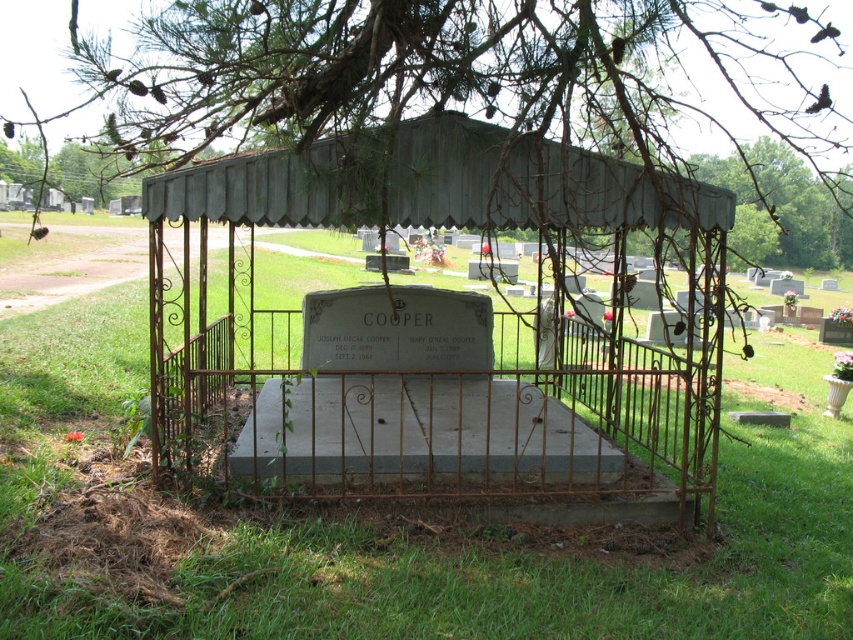
Measure the distance from green leafy tree at upper center to metallic gray canopy at center.

They are 5.19 meters apart.

Is point (817, 35) closer to viewer compared to point (642, 188)?

That is False.

Is point (630, 104) positioned before point (229, 172)?

No, (630, 104) is further to viewer.

Locate an element on the screen. This screenshot has height=640, width=853. green leafy tree at upper center is located at coordinates (480, 84).

Measure the distance between point (666, 358) and camera.

The distance of point (666, 358) from camera is 9.89 meters.

Who is more forward, (155, 413) or (811, 588)?

Point (811, 588)

The image size is (853, 640). What do you see at coordinates (436, 330) in the screenshot?
I see `rusty metal gazebo at center` at bounding box center [436, 330].

In order to click on rusty metal gazebo at center in this screenshot , I will do `click(436, 330)`.

Between point (347, 188) and point (469, 131), which one is positioned in front?

Point (347, 188)

Is point (581, 449) less distant than point (369, 209)?

No, (581, 449) is behind (369, 209).

What do you see at coordinates (436, 330) in the screenshot? I see `rusty metal gazebo at center` at bounding box center [436, 330].

Identify the location of rusty metal gazebo at center. (436, 330).